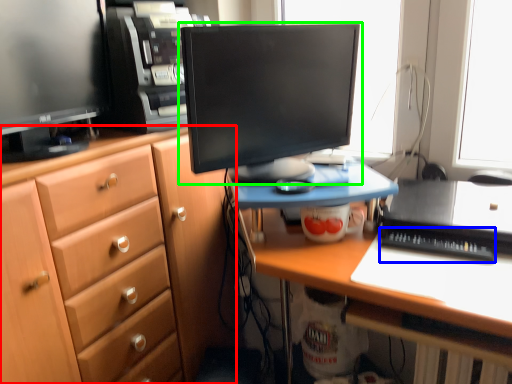
Question: Considering the real-world distances, which object is closest to cabinetry (highlighted by a red box)? laptop keyboard (highlighted by a blue box) or computer monitor (highlighted by a green box).

Choices:
 (A) laptop keyboard
 (B) computer monitor

Answer: (B)